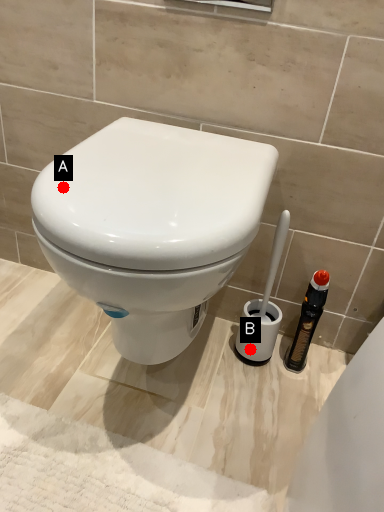
Question: Two points are circled on the image, labeled by A and B beside each circle. Which point is closer to the camera?

Choices:
 (A) A is closer
 (B) B is closer

Answer: (A)